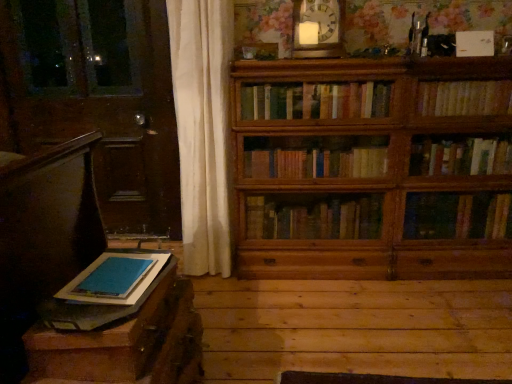
Locate an element on the screen. The height and width of the screenshot is (384, 512). free space above wooden table at lower left (from a real-world perspective) is located at coordinates (118, 271).